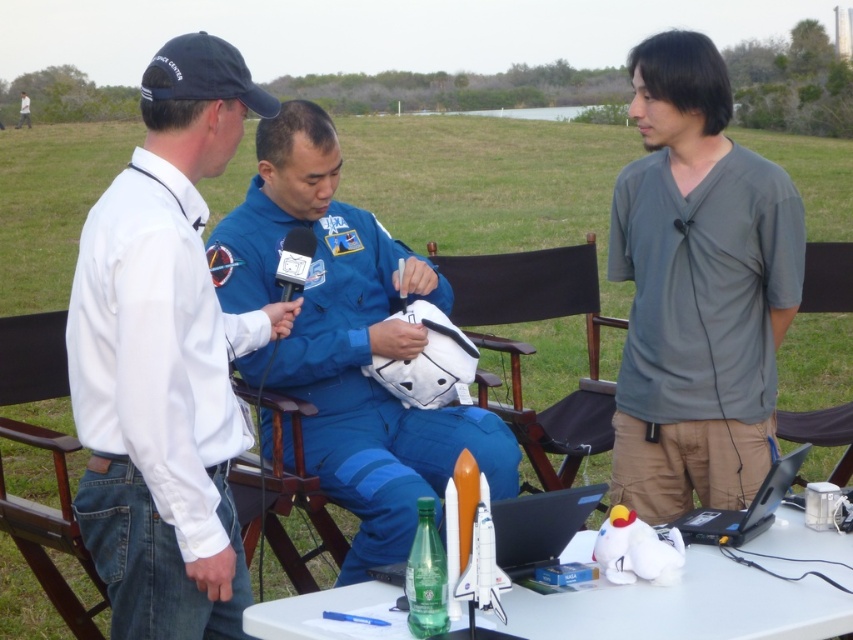
You are standing in the outdoor setting where the gray cotton shirt at center and the black fabric chair at center are present. Which object is nearer to you?

The gray cotton shirt at center is closer to the viewer than the black fabric chair at center.

You are a photographer at this event and need to ensure that all participants are visible in the group photo. Given that the white cotton shirt at left and the gray cotton shirt at center are part of the group, which one should you position closer to the camera to ensure visibility?

The white cotton shirt at left should be positioned closer to the camera because it has a larger size compared to the gray cotton shirt at center, making it more visible even from a distance.